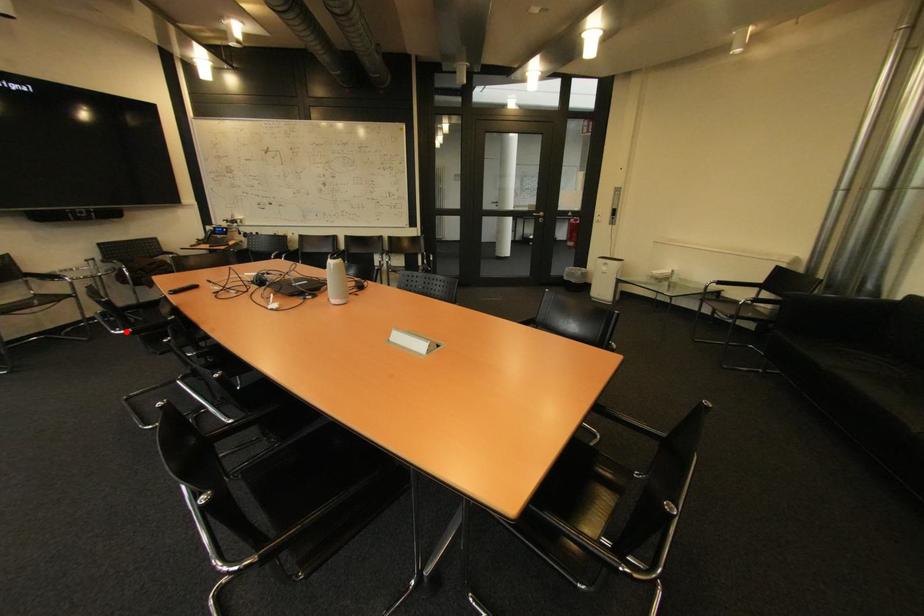
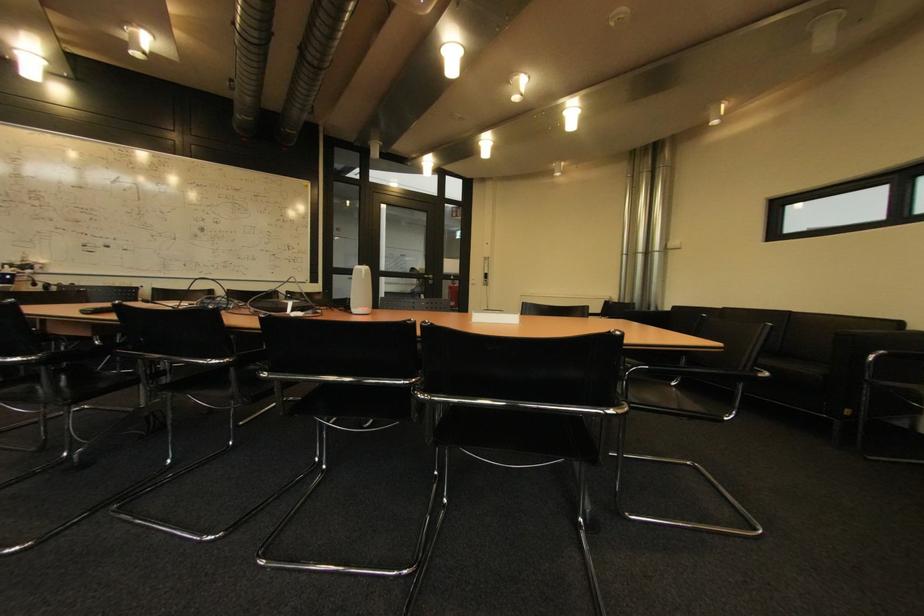
In the second image, find the point that corresponds to the highlighted location in the first image.

(22, 358)